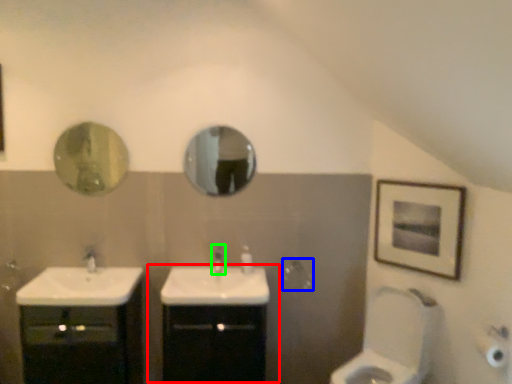
Question: Based on their relative distances, which object is farther from bathroom cabinet (highlighted by a red box)? Choose from towel bar (highlighted by a blue box) and tap (highlighted by a green box).

Choices:
 (A) towel bar
 (B) tap

Answer: (A)